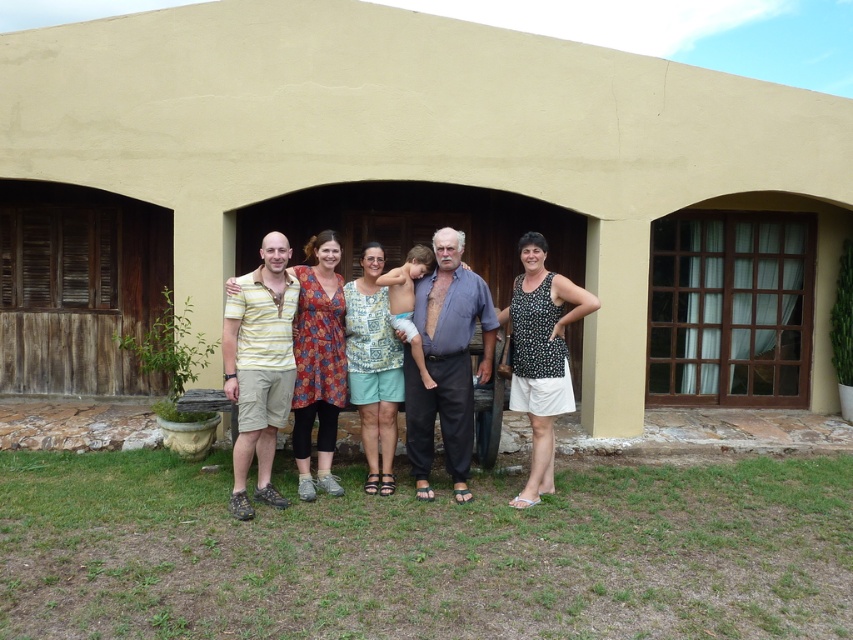
Question: Which point is farther to the camera?

Choices:
 (A) black dotted tank top at center
 (B) matte yellow shirt at center

Answer: (B)

Question: Is matte yellow shirt at center to the left of black dotted tank top at center from the viewer's perspective?

Choices:
 (A) yes
 (B) no

Answer: (A)

Question: Which of the following is the farthest from the observer?

Choices:
 (A) click(467, 428)
 (B) click(537, 266)

Answer: (A)

Question: Based on their relative distances, which object is farther from the blue cotton shirt at center?

Choices:
 (A) matte yellow shirt at center
 (B) black dotted tank top at center

Answer: (B)

Question: Does matte yellow shirt at center lie behind black dotted tank top at center?

Choices:
 (A) no
 (B) yes

Answer: (B)

Question: Is blue cotton shirt at center smaller than black dotted tank top at center?

Choices:
 (A) no
 (B) yes

Answer: (B)